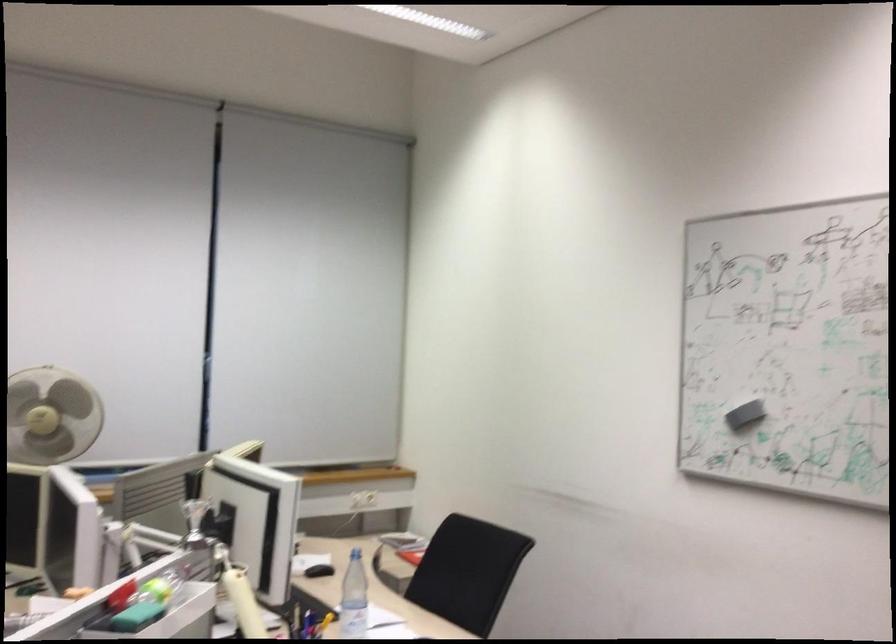
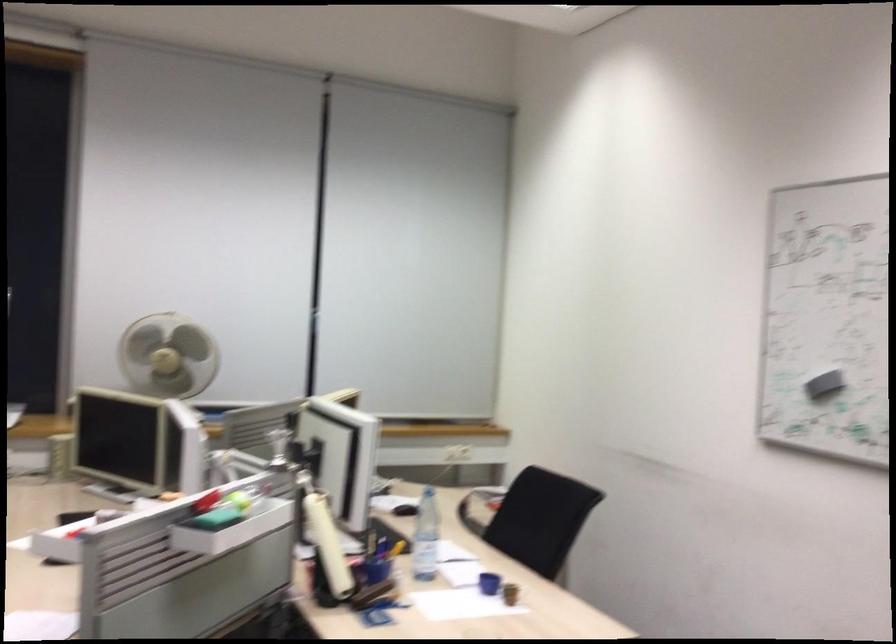
The point at (743, 421) is marked in the first image. Where is the corresponding point in the second image?

(823, 384)